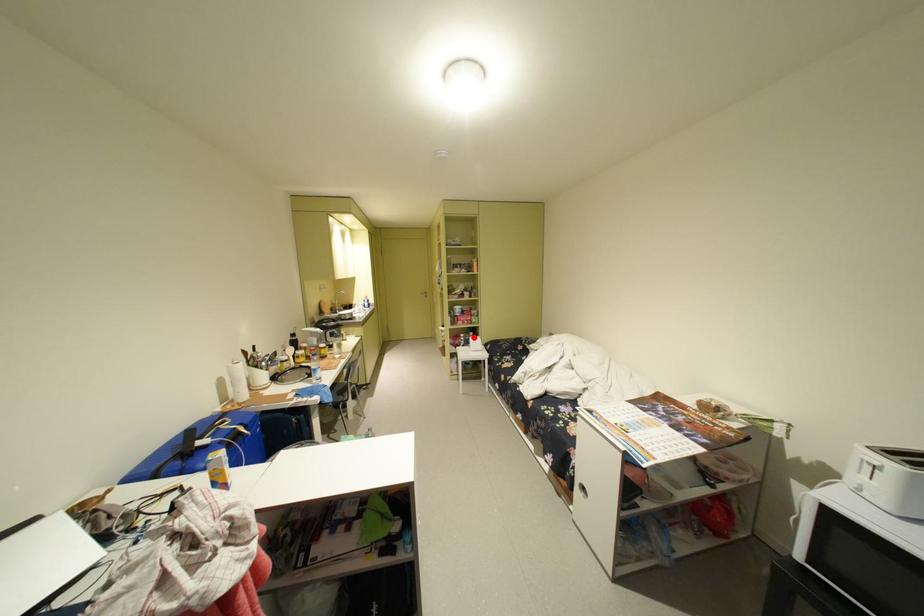
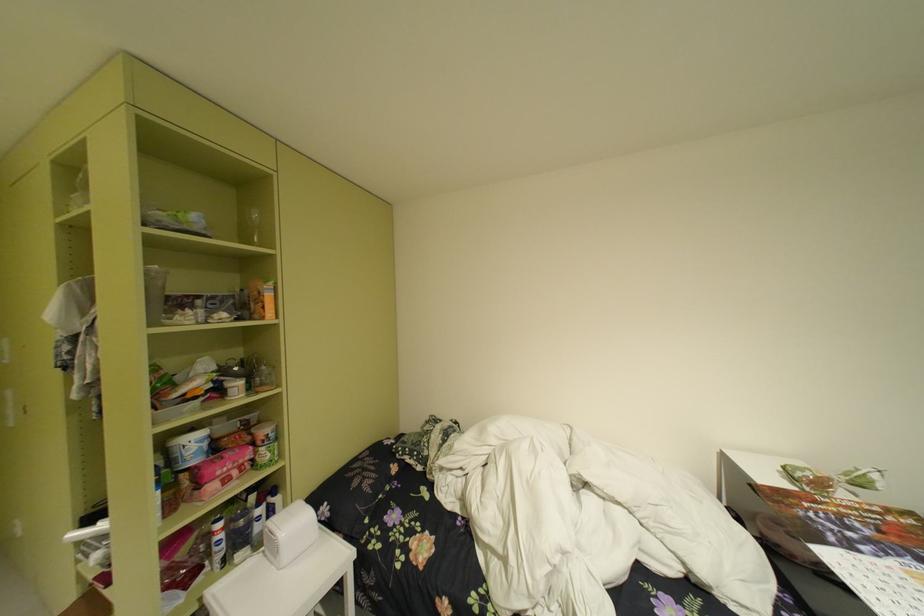
Question: A red point is marked in image1. In image2, is the corresponding 3D point closer to the camera or farther? Reply with the corresponding letter.

Choices:
 (A) The corresponding 3D point is closer.
 (B) The corresponding 3D point is farther.

Answer: (A)